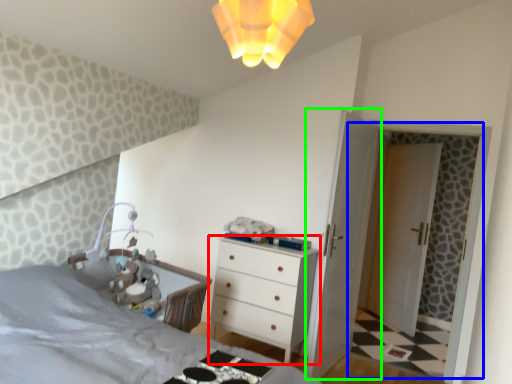
Question: Based on their relative distances, which object is farther from chest of drawers (highlighted by a red box)? Choose from screen door (highlighted by a blue box) and door (highlighted by a green box).

Choices:
 (A) screen door
 (B) door

Answer: (A)